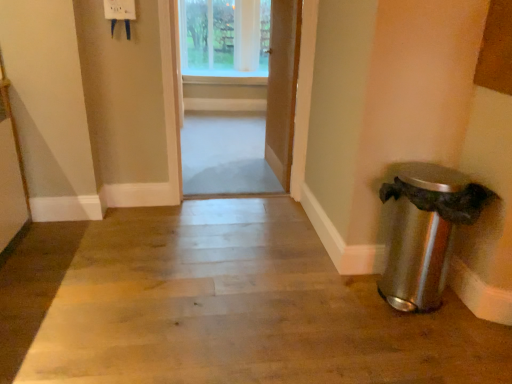
Where is `vacant space to the left of satin silver trash can at lower right`? The height and width of the screenshot is (384, 512). vacant space to the left of satin silver trash can at lower right is located at coordinates (338, 306).